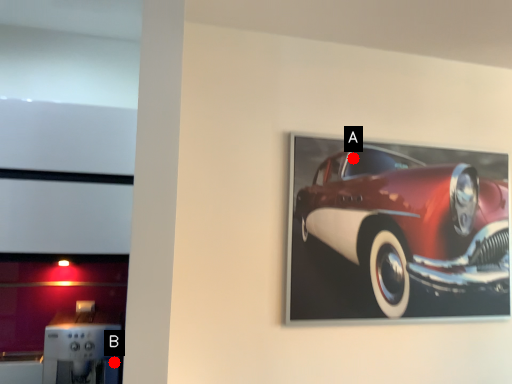
Question: Two points are circled on the image, labeled by A and B beside each circle. Among these points, which one is farthest from the camera?

Choices:
 (A) A is further
 (B) B is further

Answer: (A)